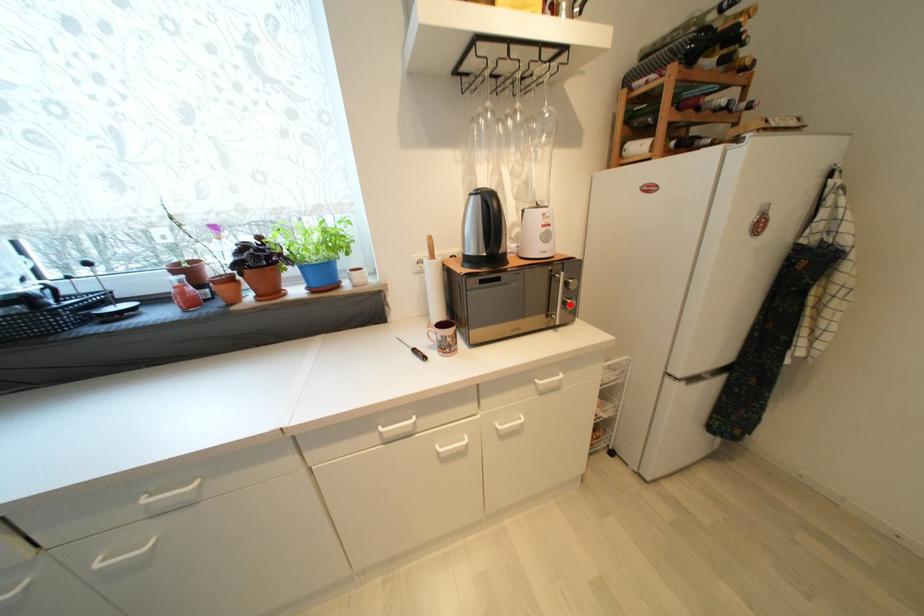
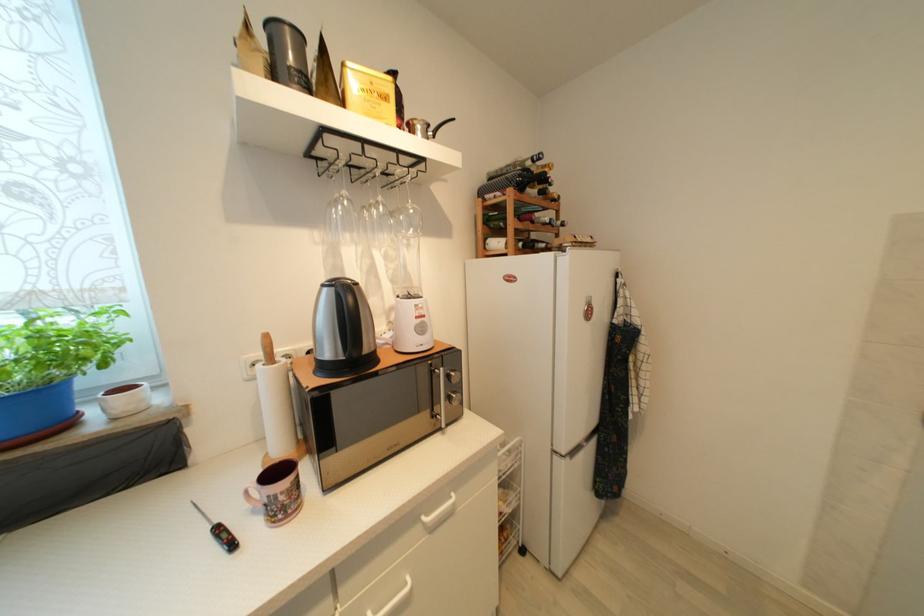
In the second image, find the point that corresponds to the highlighted location in the first image.

(455, 400)